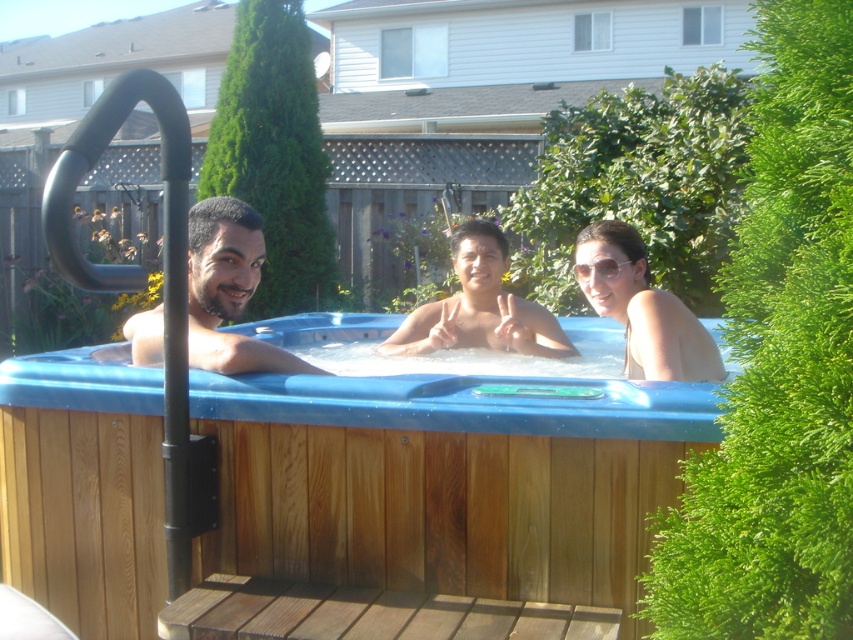
You are taking a photo of two points in the hot tub scene. The first point is at coordinates point (259, 532) and the second is at point (618, 320). Which point will appear larger in your photo?

Point (259, 532) is closer to the camera than point (618, 320), so it will appear larger in the photo.

You are a delivery person who needs to place a 15 inch package between the blue wood hot tub at center and the matte black man at center. Can the package fit in the space between them?

The blue wood hot tub at center and the matte black man at center are 16.18 inches apart. Since the package is 15 inches wide, it can fit between them as there is enough space.

You are standing in the backyard and want to place a small potted plant between the brown wooden deck at lower center and the matte white bikini at center. Which object should the plant be closer to based on their positions?

The brown wooden deck at lower center is closer to the viewer than the matte white bikini at center, so the plant should be placed closer to the matte white bikini at center to maintain equal distance between both objects.